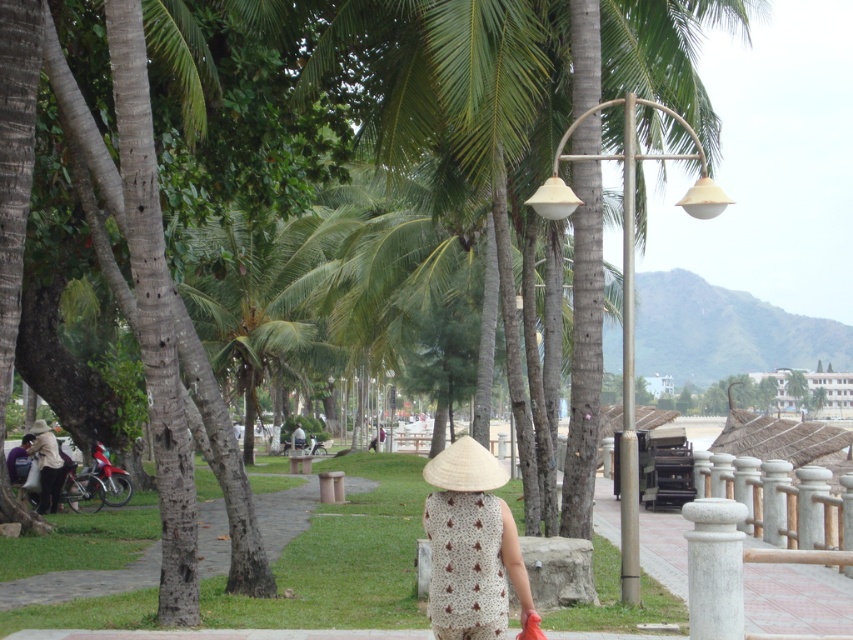
Does white woven hat at center appear over light brown woven hat at lower left?

Yes, white woven hat at center is above light brown woven hat at lower left.

Which is in front, point (517, 596) or point (59, 493)?

Point (517, 596) is in front.

Locate an element on the screen. The width and height of the screenshot is (853, 640). white woven hat at center is located at coordinates (469, 545).

Can you confirm if green grass at lower center is positioned below white straw hat at center?

Yes.

Does green grass at lower center have a lesser height compared to white straw hat at center?

In fact, green grass at lower center may be taller than white straw hat at center.

The width and height of the screenshot is (853, 640). Identify the location of green grass at lower center. (82, 582).

Between point (469, 458) and point (53, 464), which one is positioned in front?

Point (469, 458) is more forward.

Which is behind, point (451, 452) or point (38, 435)?

The point (38, 435) is more distant.

Between point (479, 468) and point (55, 445), which one is positioned behind?

Positioned behind is point (55, 445).

You are a GUI agent. You are given a task and a screenshot of the screen. Output one action in this format:
    pyautogui.click(x=<x>, y=<y>)
    Task: Click on the white straw hat at center
    The image size is (853, 640).
    Given the screenshot: What is the action you would take?
    pyautogui.click(x=465, y=467)